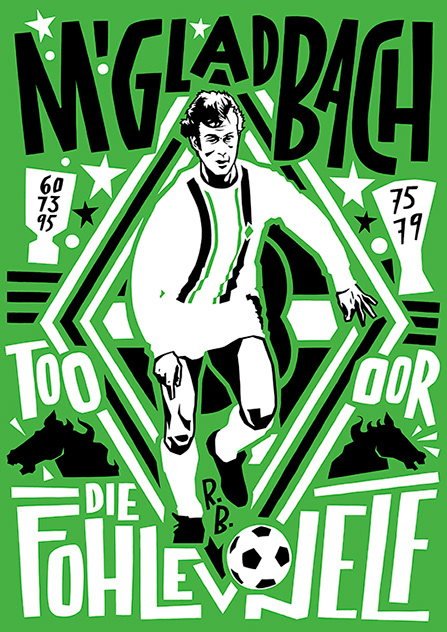
Provide coordinates for each diamond stripe art behind the soccer player. white stripes, with a black stripe in the middle instance in the image. Your answer should be formatted as a list of tuples, i.e. [(x1, y1), (x2, y2), ...], where each tuple contains the x and y coordinates of a point satisfying the conditions above.

[(104, 251), (391, 317), (204, 574), (257, 102)]